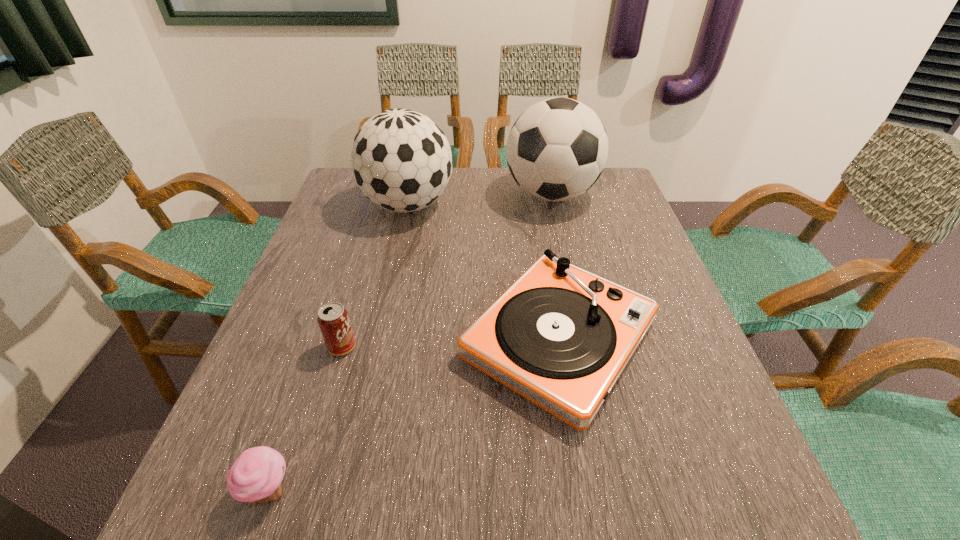
Identify the location of object at the near edge. (255, 477).

Find the location of a particular element. soccer ball at the left edge is located at coordinates (401, 160).

Identify the location of soda can present at the left edge. (333, 319).

The width and height of the screenshot is (960, 540). What are the coordinates of `cupcake present at the left edge` in the screenshot? It's located at (255, 477).

The width and height of the screenshot is (960, 540). I want to click on soccer ball located in the right edge section of the desktop, so click(x=557, y=149).

This screenshot has height=540, width=960. Find the location of `record player located in the right edge section of the desktop`. record player located in the right edge section of the desktop is located at coordinates (560, 336).

This screenshot has height=540, width=960. Find the location of `object located in the far left corner section of the desktop`. object located in the far left corner section of the desktop is located at coordinates (401, 160).

Where is `object that is positioned at the near left corner`? object that is positioned at the near left corner is located at coordinates (255, 477).

Identify the location of object located in the far right corner section of the desktop. This screenshot has height=540, width=960. (557, 149).

The image size is (960, 540). In the image, there is a desktop. Identify the location of vacant space at the far edge. (463, 195).